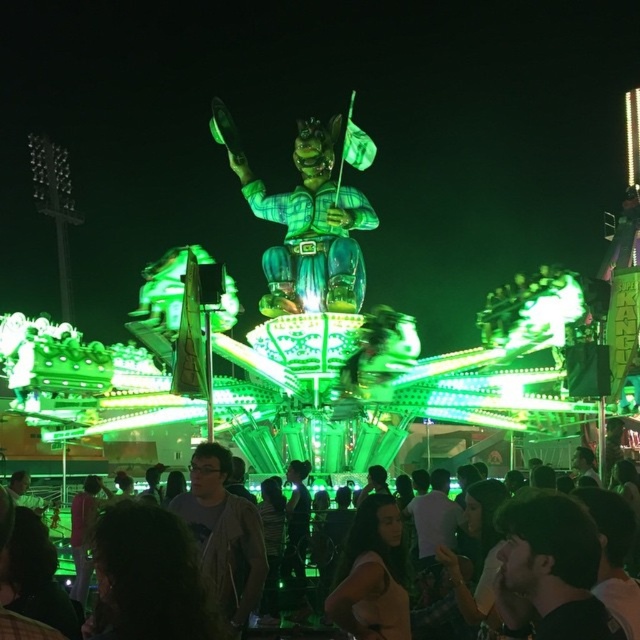
Question: Which point is closer to the camera?

Choices:
 (A) (212, 563)
 (B) (516, 545)
 (C) (445, 484)

Answer: (B)

Question: Where is dark hair at lower center located in relation to matte black shirt at center in the image?

Choices:
 (A) left
 (B) right

Answer: (A)

Question: Which point is farther to the camera?

Choices:
 (A) (557, 576)
 (B) (435, 545)
 (C) (209, 541)
 (D) (536, 572)

Answer: (B)

Question: Is gray matte jacket at center positioned in front of dark hair at lower center?

Choices:
 (A) no
 (B) yes

Answer: (A)

Question: Does gray matte jacket at center appear over dark hair at lower center?

Choices:
 (A) yes
 (B) no

Answer: (A)

Question: Which point is farther to the camera?

Choices:
 (A) dark brown hair at lower right
 (B) gray matte jacket at center
 (C) matte black shirt at center

Answer: (C)